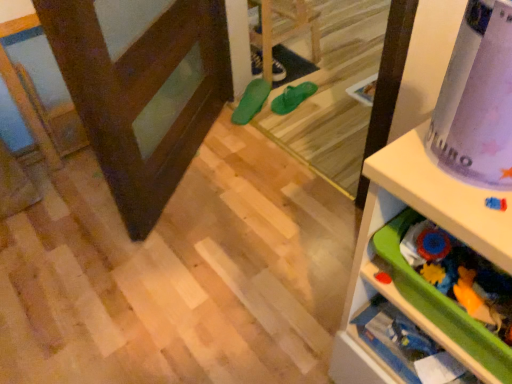
Locate an element on the screen. space that is in front of dark brown wood screen door at left is located at coordinates (183, 267).